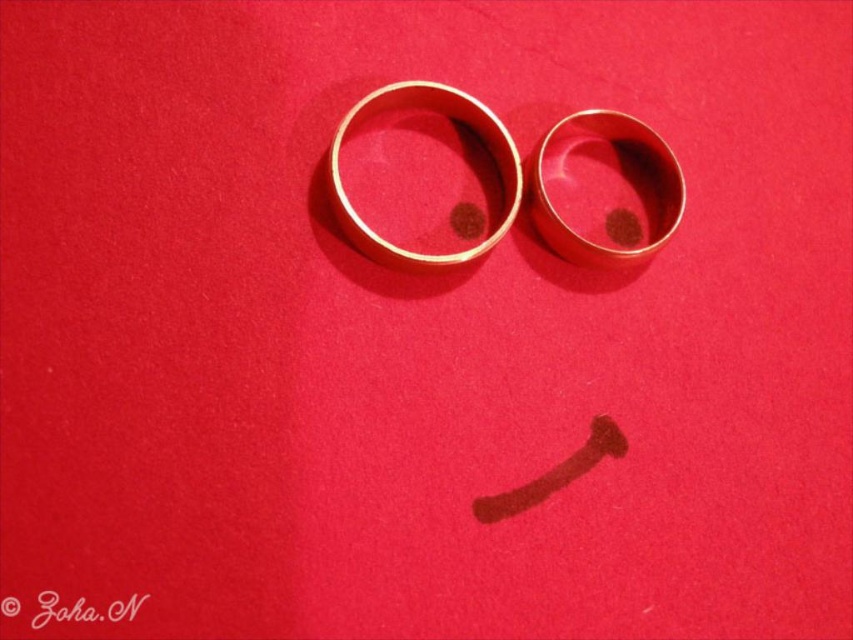
You are an appraiser assessing the value of two gold polished rings. You observe the gold polished ring at upper right and the gold polished ring at center in the image. Which ring has a smaller diameter?

The gold polished ring at upper right has a smaller diameter because it is thinner than the gold polished ring at center.

You are standing in front of the image and want to know how far the point labeled as point (584, 148) is from you. Can you determine the distance?

The point labeled as point (584, 148) is 4.81 feet away from the camera, so the distance from you to the point would be approximately 4.81 feet.

You are an architect designing a model and need to place a small flag exactly at the center of the gold polished ring at upper right. According to the coordinates provided, what are the coordinates where you should place the flag?

The coordinates for the gold polished ring at upper right are at point (619, 177), so you should place the flag at those coordinates.